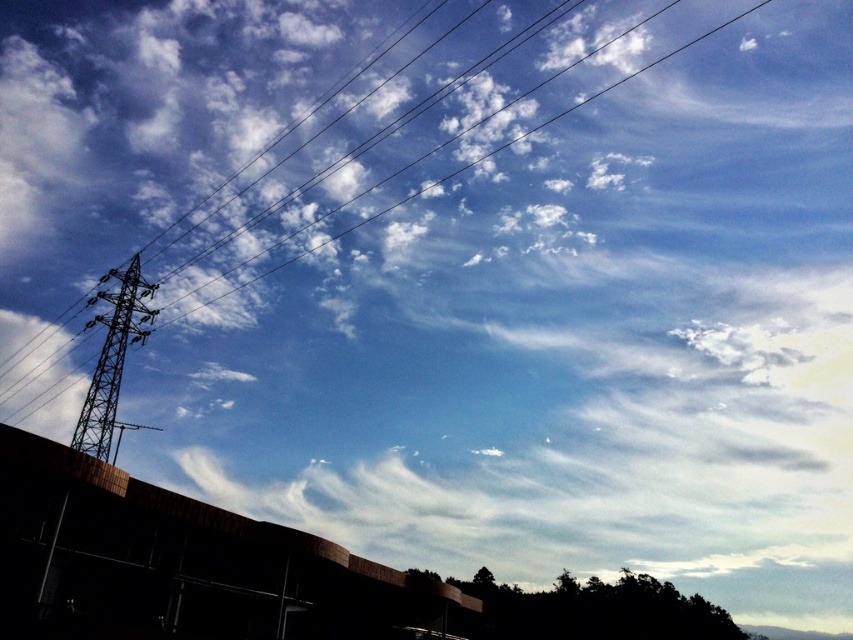
Question: Which point is farther to the camera?

Choices:
 (A) (109, 392)
 (B) (196, 308)

Answer: (B)

Question: Is metallic structure at left to the left of metallic wire at upper left from the viewer's perspective?

Choices:
 (A) no
 (B) yes

Answer: (B)

Question: From the image, what is the correct spatial relationship of metallic structure at left in relation to metallic wire at upper left?

Choices:
 (A) right
 (B) left

Answer: (B)

Question: Which point appears farthest from the camera in this image?

Choices:
 (A) (9, 356)
 (B) (142, 310)

Answer: (A)

Question: Can you confirm if metallic structure at left is thinner than metallic wire at upper left?

Choices:
 (A) no
 (B) yes

Answer: (B)